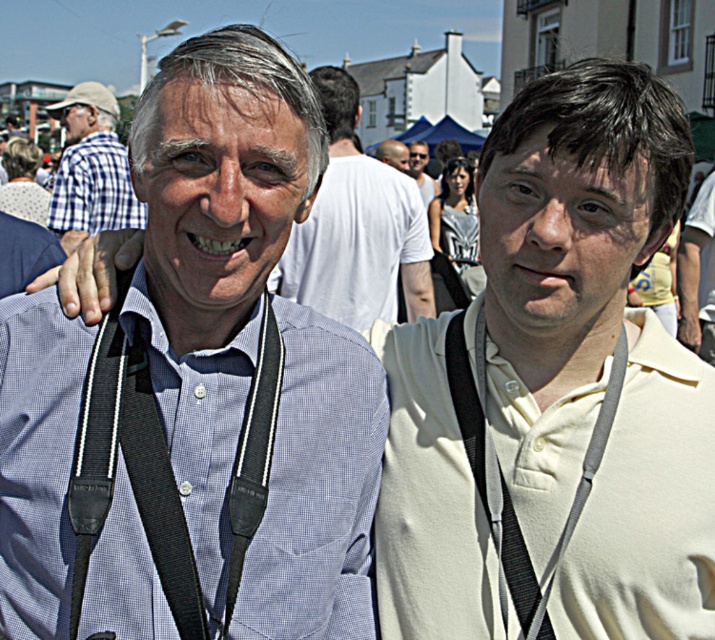
Question: Which point appears farthest from the camera in this image?

Choices:
 (A) (78, 531)
 (B) (423, 186)
 (C) (699, 214)

Answer: (B)

Question: Is matte blue shirt at center wider than matte white sunglasses at center?

Choices:
 (A) no
 (B) yes

Answer: (B)

Question: Is checkered fabric shirt at left positioned before matte white sunglasses at center?

Choices:
 (A) yes
 (B) no

Answer: (A)

Question: Which point is farther to the camera?

Choices:
 (A) blue checkered shirt at center
 (B) black fabric strap at right
 (C) matte blue shirt at center

Answer: (C)

Question: Which object is the farthest from the black fabric suspenders at left?

Choices:
 (A) white matte shirt at center
 (B) black fabric strap at right
 (C) blue checkered shirt at center
 (D) matte white sunglasses at center

Answer: (D)

Question: Is black fabric suspenders at left to the right of matte blue shirt at center from the viewer's perspective?

Choices:
 (A) yes
 (B) no

Answer: (B)